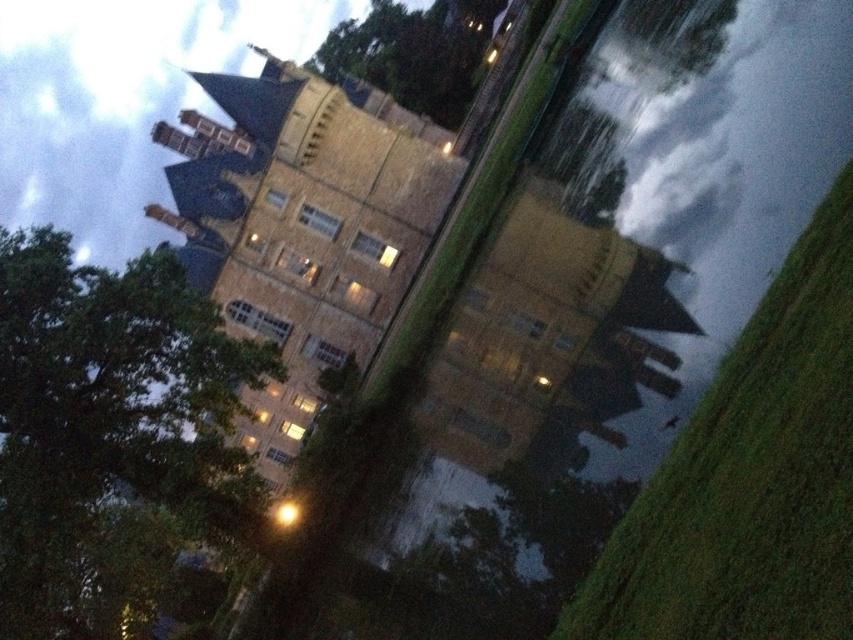
You are standing at the center of the image. Which direction should you look to see the green leafy tree at left?

The green leafy tree at left is located at point (106, 433), so you should look to the left side of the image to see it.

You are an architect analyzing the layout of the building and its surroundings. You notice two green leafy trees in the scene. Which tree, the green leafy tree at left or the green leafy tree at upper center, has a larger size?

The green leafy tree at upper center is larger than the green leafy tree at left.